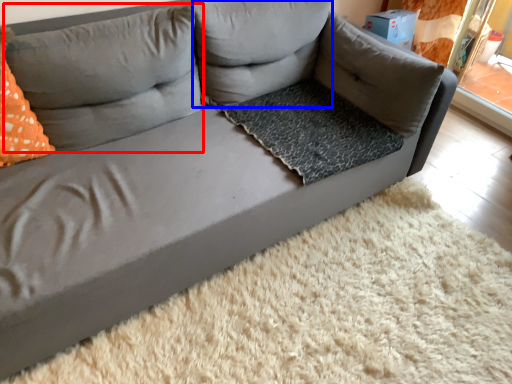
Question: Which point is closer to the camera, pillow (highlighted by a red box) or pillow (highlighted by a blue box)?

Choices:
 (A) pillow
 (B) pillow

Answer: (A)